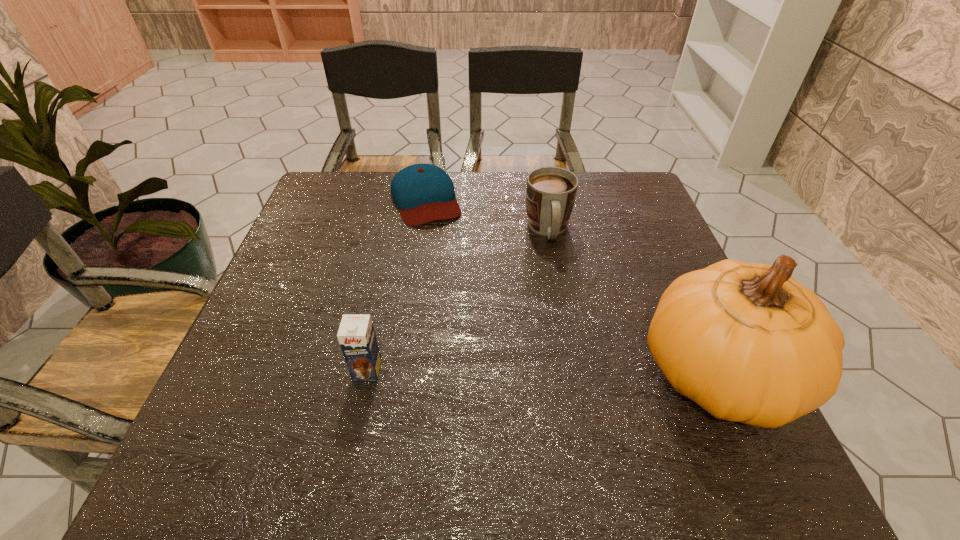
Identify the location of chocolate milk. (356, 336).

This screenshot has height=540, width=960. I want to click on the rightmost object, so click(x=748, y=343).

The image size is (960, 540). Find the location of `pumpkin`. pumpkin is located at coordinates (748, 343).

At what (x,y) coordinates should I click in order to perform the action: click on the third object from left to right. Please return your answer as a coordinate pair (x, y). Looking at the image, I should click on (551, 191).

The height and width of the screenshot is (540, 960). Find the location of `baseball cap`. baseball cap is located at coordinates (423, 193).

I want to click on free space located 0.070m on the side of the third object from left to right with the handle, so click(x=556, y=272).

Identify the location of vacant space located on the side of the third object from left to right with the handle. The image size is (960, 540). (576, 390).

Identify the location of vacant space located on the side of the third object from left to right with the handle. (564, 324).

Image resolution: width=960 pixels, height=540 pixels. In order to click on vacant space located 0.210m with the bill of the shortest object facing forward in this screenshot , I will do `click(454, 279)`.

Identify the location of free point located with the bill of the shortest object facing forward. (444, 252).